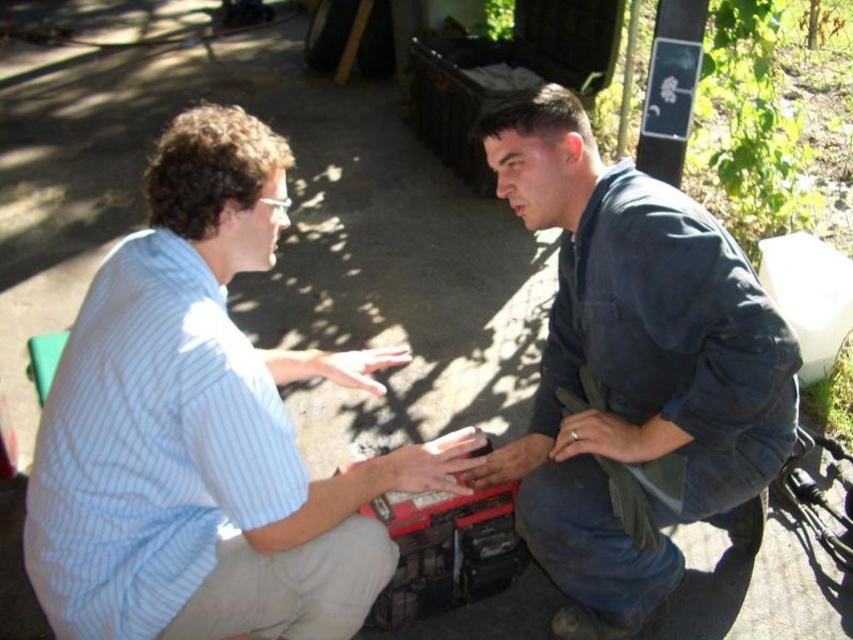
Who is more forward, (247, 600) or (550, 438)?

Point (247, 600) is in front.

Is light blue striped shirt at center positioned in front of dark blue denim jeans at center?

That is True.

Is point (242, 476) farther from viewer compared to point (618, 588)?

That is False.

Identify the location of light blue striped shirt at center. The image size is (853, 640). (204, 429).